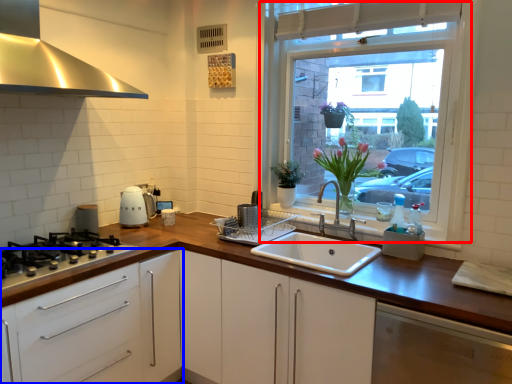
Question: Among these objects, which one is nearest to the camera, window (highlighted by a red box) or cabinetry (highlighted by a blue box)?

Choices:
 (A) window
 (B) cabinetry

Answer: (B)